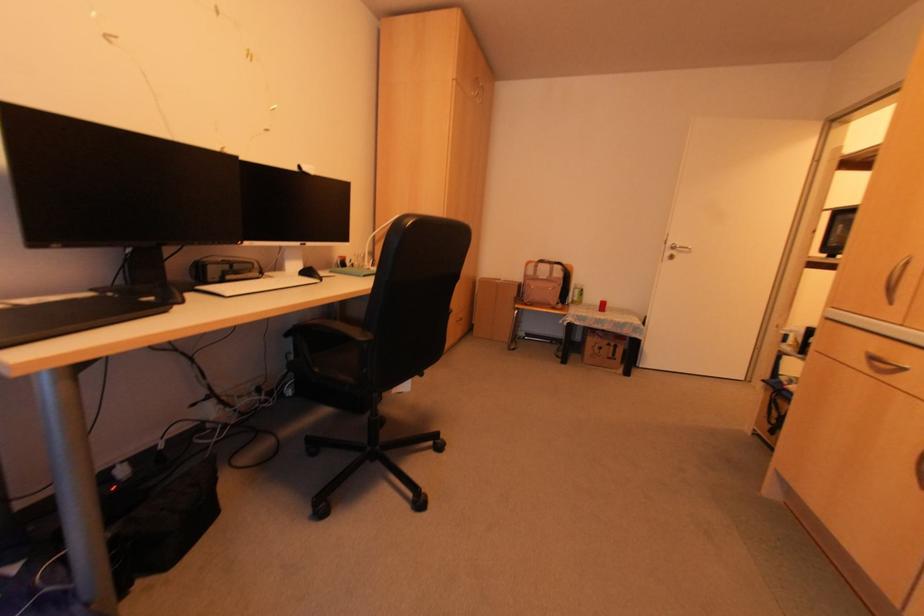
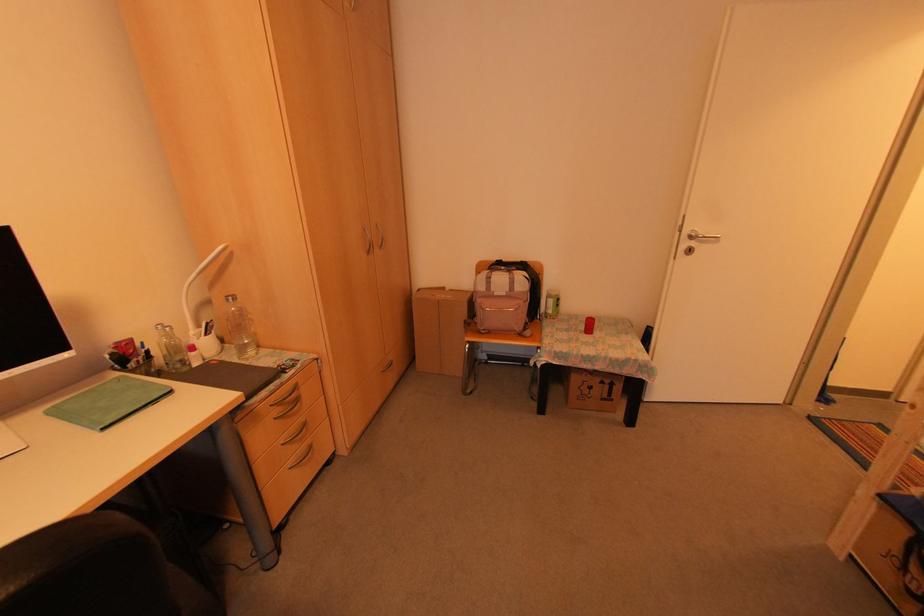
The point at (604, 342) is marked in the first image. Where is the corresponding point in the second image?

(598, 381)